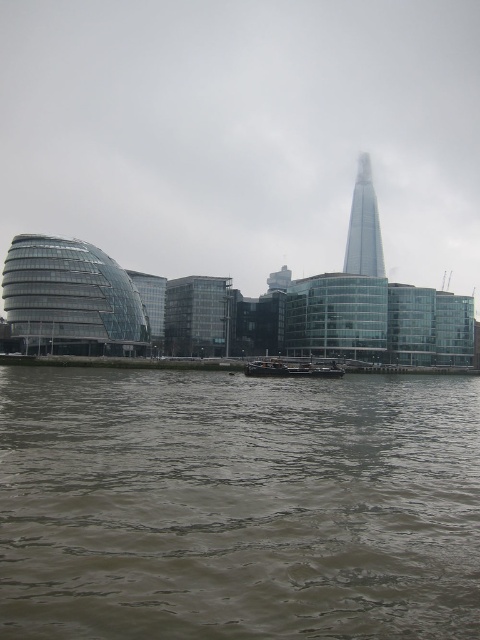
You are a tourist standing on the riverbank and want to take a photo of the transparent glass buildings at center and the glassy skyscraper at upper right. Which one will appear closer to you in the photo?

The transparent glass buildings at center will appear closer to you in the photo because they are positioned in front of the glassy skyscraper at upper right.

You are a photographer planning to capture the entire scene in one shot. Given that the brown murky water at lower center and the glassy skyscraper at upper right are both in your frame, which object occupies a wider horizontal space in the image?

The brown murky water at lower center occupies a wider horizontal space than the glassy skyscraper at upper right because its width surpasses the skyscraper.

You are standing on the dock and want to cross to the other side. The boat is at the center of the image. Is the brown murky water at lower center in your path to the boat?

The brown murky water at lower center is located at point (238,506), which is near the center of the image. Since the boat is also at the center, the brown murky water at lower center is likely in your path to the boat.